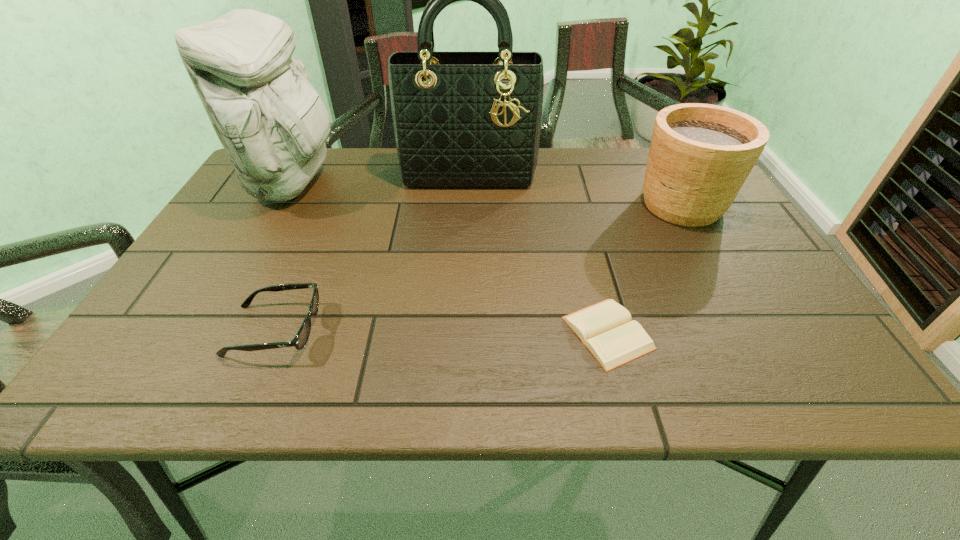
The width and height of the screenshot is (960, 540). What are the coordinates of `the third object from right to left` in the screenshot? It's located at (466, 121).

You are a GUI agent. You are given a task and a screenshot of the screen. Output one action in this format:
    pyautogui.click(x=<x>, y=<y>)
    Task: Click on the backpack
    The height and width of the screenshot is (540, 960).
    Given the screenshot: What is the action you would take?
    pyautogui.click(x=271, y=121)

Identify the location of the rightmost object. The width and height of the screenshot is (960, 540). (700, 155).

The width and height of the screenshot is (960, 540). I want to click on flowerpot, so click(700, 155).

This screenshot has height=540, width=960. Identify the location of spectacles. (299, 341).

This screenshot has height=540, width=960. Find the location of `diary`. diary is located at coordinates (605, 328).

This screenshot has height=540, width=960. What are the coordinates of `the shortest object` in the screenshot? It's located at (605, 328).

Where is `vacant space located 0.140m at the front of the third object from right to left with visible charms`? The height and width of the screenshot is (540, 960). vacant space located 0.140m at the front of the third object from right to left with visible charms is located at coordinates (467, 221).

The height and width of the screenshot is (540, 960). What are the coordinates of `vacant region located 0.350m on the front-facing side of the backpack` in the screenshot? It's located at (464, 183).

The image size is (960, 540). Identify the location of vacant position located on the front of the third tallest object. (714, 260).